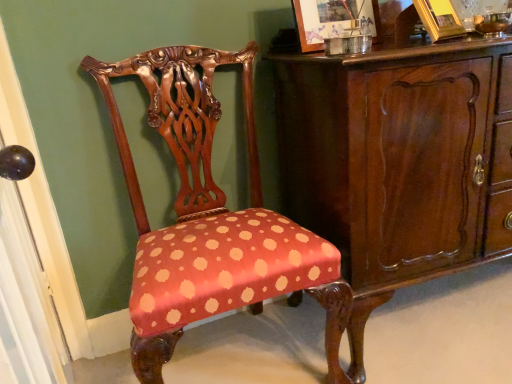
Question: Could you tell me if gold metallic picture frame at upper right, which appears as the 1th picture frame when viewed from the right, is turned towards polka dot fabric chair at center?

Choices:
 (A) no
 (B) yes

Answer: (A)

Question: Is gold metallic picture frame at upper right, positioned as the 2th picture frame in left-to-right order, far from polka dot fabric chair at center?

Choices:
 (A) no
 (B) yes

Answer: (A)

Question: Does gold metallic picture frame at upper right, which appears as the 1th picture frame when viewed from the right, have a lesser width compared to polka dot fabric chair at center?

Choices:
 (A) no
 (B) yes

Answer: (B)

Question: Can you confirm if gold metallic picture frame at upper right, positioned as the 2th picture frame in left-to-right order, is shorter than polka dot fabric chair at center?

Choices:
 (A) no
 (B) yes

Answer: (B)

Question: From the image's perspective, does gold metallic picture frame at upper right, positioned as the 2th picture frame in left-to-right order, appear higher than polka dot fabric chair at center?

Choices:
 (A) no
 (B) yes

Answer: (B)

Question: From the image's perspective, is gold metallic picture frame at upper right, positioned as the 2th picture frame in left-to-right order, beneath polka dot fabric chair at center?

Choices:
 (A) yes
 (B) no

Answer: (B)

Question: Considering the relative sizes of mahogany wood cabinet at center and polka dot fabric chair at center in the image provided, is mahogany wood cabinet at center shorter than polka dot fabric chair at center?

Choices:
 (A) no
 (B) yes

Answer: (B)

Question: Can you confirm if mahogany wood cabinet at center is wider than polka dot fabric chair at center?

Choices:
 (A) yes
 (B) no

Answer: (A)

Question: From a real-world perspective, is mahogany wood cabinet at center positioned over polka dot fabric chair at center based on gravity?

Choices:
 (A) no
 (B) yes

Answer: (A)

Question: Is mahogany wood cabinet at center oriented away from polka dot fabric chair at center?

Choices:
 (A) no
 (B) yes

Answer: (A)

Question: Is the position of mahogany wood cabinet at center more distant than that of polka dot fabric chair at center?

Choices:
 (A) yes
 (B) no

Answer: (A)

Question: From a real-world perspective, is mahogany wood cabinet at center under polka dot fabric chair at center?

Choices:
 (A) yes
 (B) no

Answer: (A)

Question: Does mahogany wood cabinet at center touch gold metallic picture frame at upper right, positioned as the 2th picture frame in left-to-right order?

Choices:
 (A) no
 (B) yes

Answer: (A)